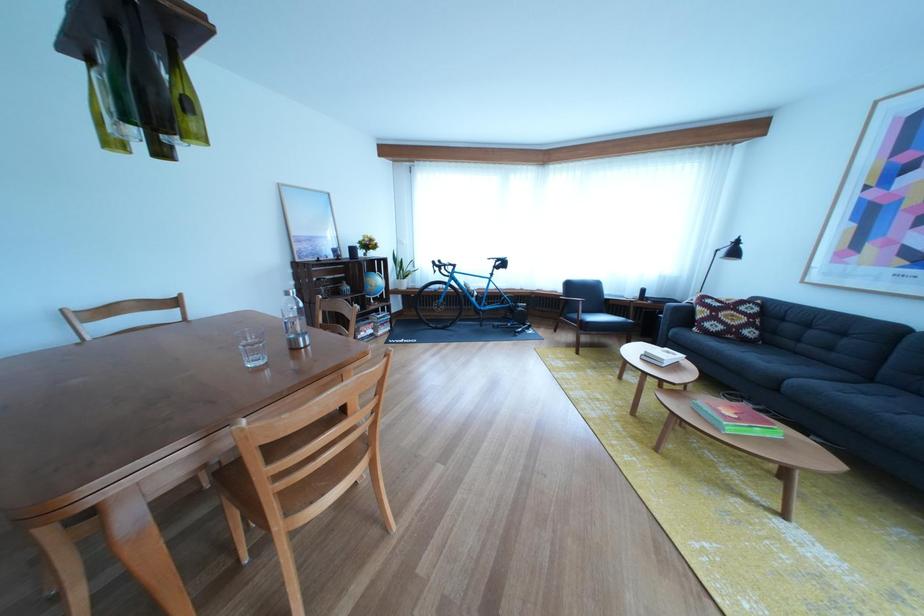
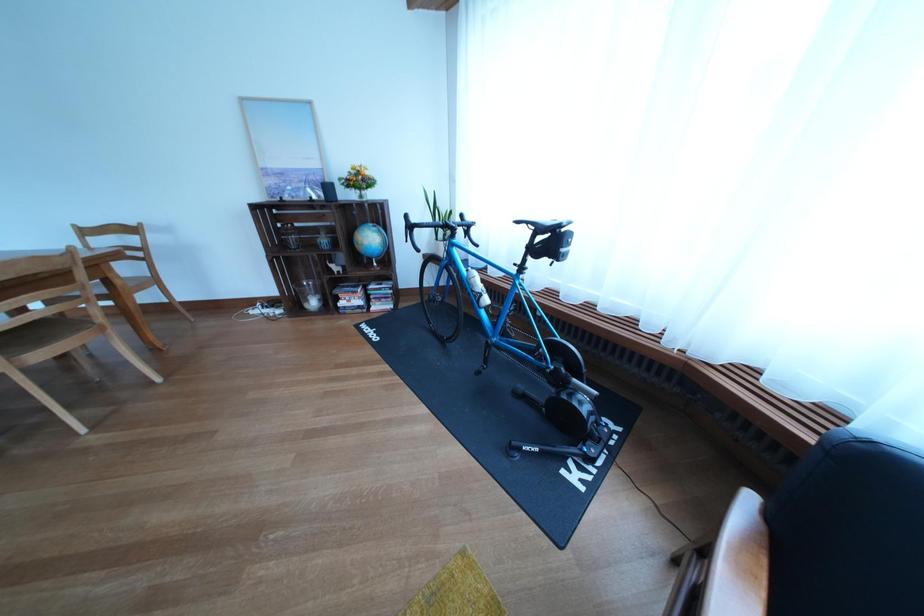
In the second image, find the point that corresponds to (x=382, y=251) in the first image.

(372, 185)